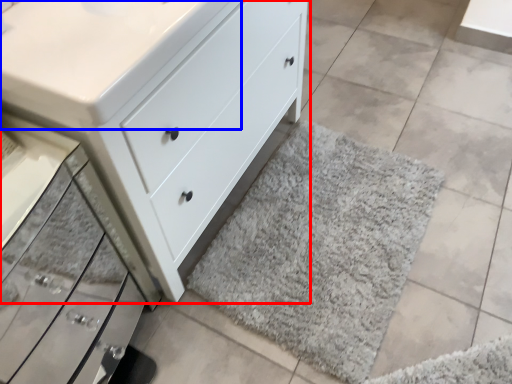
Question: Which point is further to the camera, chest of drawers (highlighted by a red box) or counter top (highlighted by a blue box)?

Choices:
 (A) chest of drawers
 (B) counter top

Answer: (B)